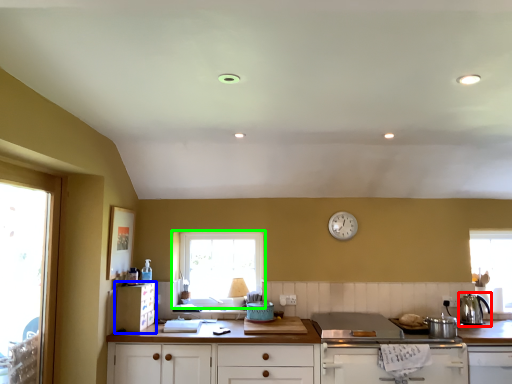
Question: Which object is positioned closest to kitchen appliance (highlighted by a red box)? Select from cabinetry (highlighted by a blue box) and window (highlighted by a green box).

Choices:
 (A) cabinetry
 (B) window

Answer: (B)